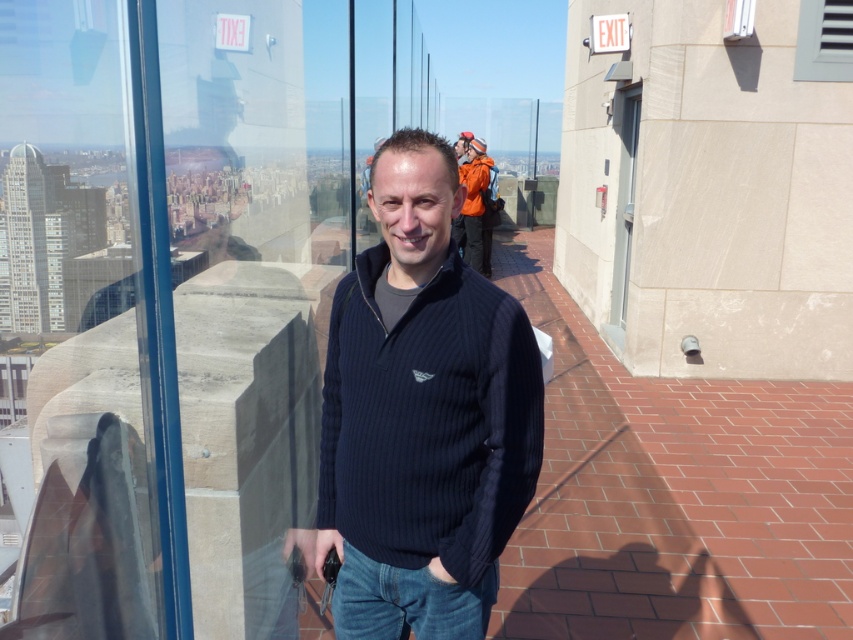
Can you confirm if orange fabric jacket at upper center is positioned below clear glass window at upper right?

Yes, orange fabric jacket at upper center is below clear glass window at upper right.

Is orange fabric jacket at upper center closer to camera compared to clear glass window at upper right?

No.

Is point (474, 252) positioned behind point (732, 10)?

Yes, point (474, 252) is behind point (732, 10).

Identify the location of orange fabric jacket at upper center. The width and height of the screenshot is (853, 640). (474, 202).

Between point (811, 74) and point (740, 0), which one is positioned behind?

The point (811, 74) is behind.

Which is behind, point (825, 74) or point (728, 13)?

The point (825, 74) is more distant.

This screenshot has width=853, height=640. In order to click on gray matte vent at upper right in this screenshot , I will do `click(824, 40)`.

Is black ribbed sweater at center to the left of orange fabric jacket at upper center from the viewer's perspective?

Correct, you'll find black ribbed sweater at center to the left of orange fabric jacket at upper center.

Which of these two, black ribbed sweater at center or orange fabric jacket at upper center, stands shorter?

black ribbed sweater at center is shorter.

Is point (422, 448) more distant than point (488, 184)?

No, (422, 448) is closer to viewer.

Where is `black ribbed sweater at center`? black ribbed sweater at center is located at coordinates (422, 416).